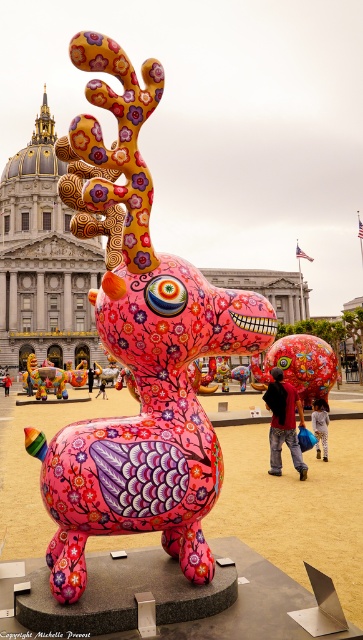
Question: Which of the following is the closest to the observer?

Choices:
 (A) (156, 340)
 (B) (299, 387)

Answer: (A)

Question: Can you confirm if pink glossy deer at center is smaller than shiny metallic elephant at center?

Choices:
 (A) yes
 (B) no

Answer: (B)

Question: Is pink glossy deer at center positioned behind shiny metallic elephant at center?

Choices:
 (A) yes
 (B) no

Answer: (B)

Question: Among these objects, which one is nearest to the camera?

Choices:
 (A) pink glossy deer at center
 (B) shiny metallic elephant at center

Answer: (A)

Question: Is pink glossy deer at center below shiny metallic elephant at center?

Choices:
 (A) no
 (B) yes

Answer: (A)